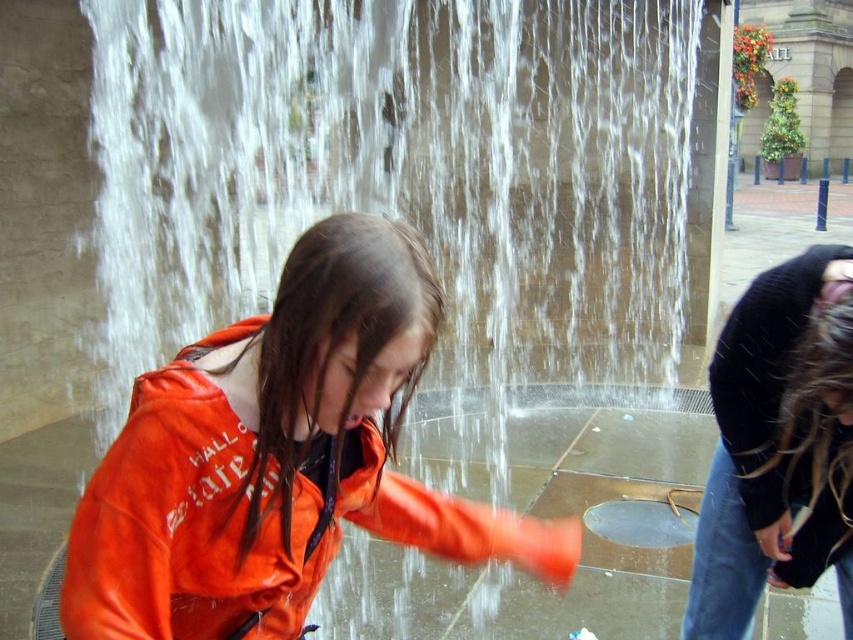
Can you confirm if orange leather jacket at center is taller than black sweater at lower right?

Correct, orange leather jacket at center is much taller as black sweater at lower right.

Looking at this image, is orange leather jacket at center further to the viewer compared to black sweater at lower right?

No.

What do you see at coordinates (279, 458) in the screenshot? Image resolution: width=853 pixels, height=640 pixels. I see `orange leather jacket at center` at bounding box center [279, 458].

The width and height of the screenshot is (853, 640). I want to click on orange leather jacket at center, so click(x=279, y=458).